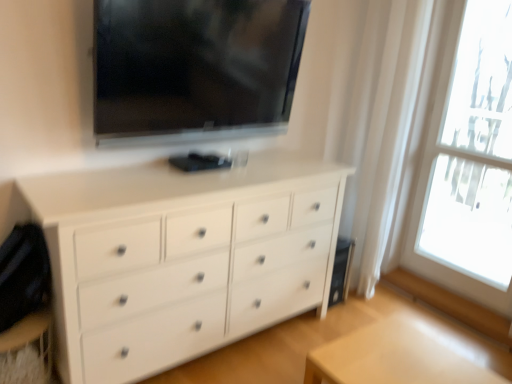
What are the coordinates of `vacant region under black glossy tv at upper center (from a real-world perspective)` in the screenshot? It's located at (177, 167).